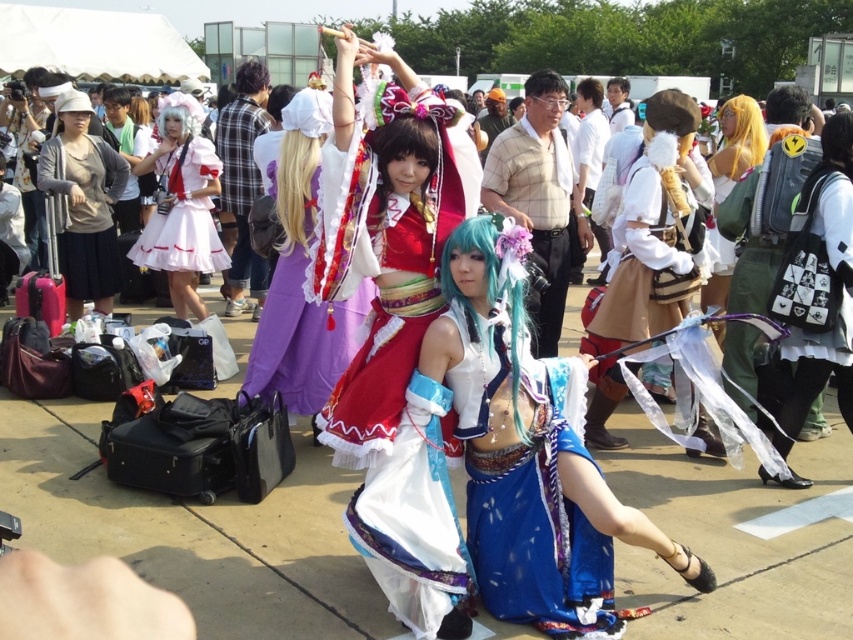
Question: Which is nearer to the shiny red fabric dress at center?

Choices:
 (A) purple satin dress at center
 (B) matte pink dress at left
 (C) shiny blue fabric dress at center
 (D) light brown hair at center

Answer: (C)

Question: Can you confirm if purple satin dress at center is bigger than matte pink dress at left?

Choices:
 (A) no
 (B) yes

Answer: (B)

Question: Can you confirm if shiny red fabric dress at center is bigger than matte gray sweater at left?

Choices:
 (A) yes
 (B) no

Answer: (A)

Question: Which of the following is the farthest from the observer?

Choices:
 (A) (288, 321)
 (B) (113, 192)
 (C) (514, 481)
 (D) (177, 100)

Answer: (D)

Question: Which of the following is the farthest from the observer?

Choices:
 (A) (506, 307)
 (B) (165, 125)
 (C) (410, 240)
 (D) (80, 266)

Answer: (B)

Question: Is shiny blue fabric dress at center below purple satin dress at center?

Choices:
 (A) no
 (B) yes

Answer: (B)